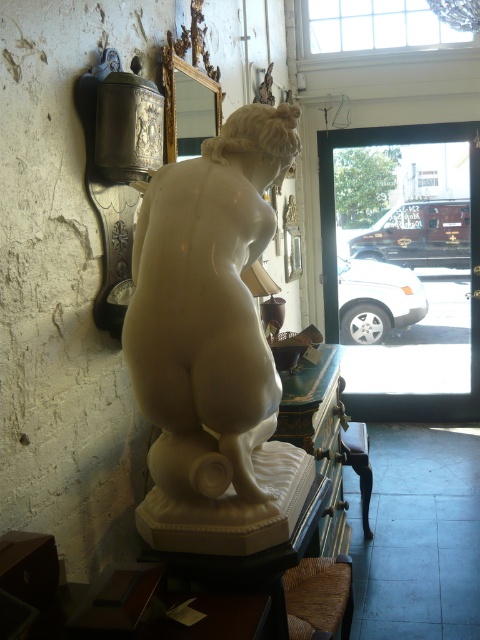
Is point (191, 170) positioned behind point (348, 461)?

No.

Between point (251, 189) and point (361, 518), which one is positioned in front?

Point (251, 189) is more forward.

The image size is (480, 640). In order to click on white marble statue at left in this screenshot , I will do `click(213, 346)`.

Identify the location of white marble statue at left. This screenshot has width=480, height=640. (213, 346).

Who is shorter, white marble statue at left or brown woven stool at lower center?

brown woven stool at lower center is shorter.

Which is in front, point (276, 518) or point (327, 579)?

Point (276, 518) is more forward.

Identify the location of white marble statue at left. (213, 346).

Is brown woven stool at lower center to the right of wooden stool at lower center from the viewer's perspective?

Incorrect, brown woven stool at lower center is not on the right side of wooden stool at lower center.

Is brown woven stool at lower center to the left of wooden stool at lower center from the viewer's perspective?

Correct, you'll find brown woven stool at lower center to the left of wooden stool at lower center.

Who is more distant from viewer, (294, 579) or (370, 483)?

The point (370, 483) is more distant.

Identify the location of brown woven stool at lower center. The height and width of the screenshot is (640, 480). (319, 596).